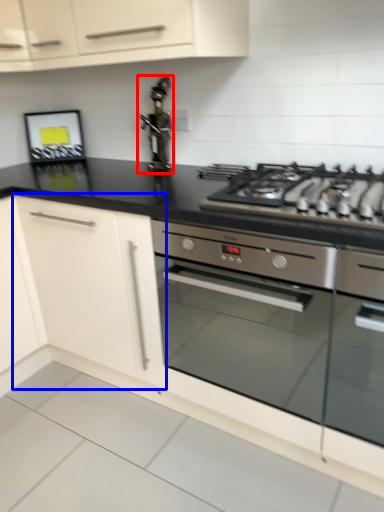
Question: Which point is closer to the camera, stainless steel (highlighted by a red box) or cabinetry (highlighted by a blue box)?

Choices:
 (A) stainless steel
 (B) cabinetry

Answer: (B)